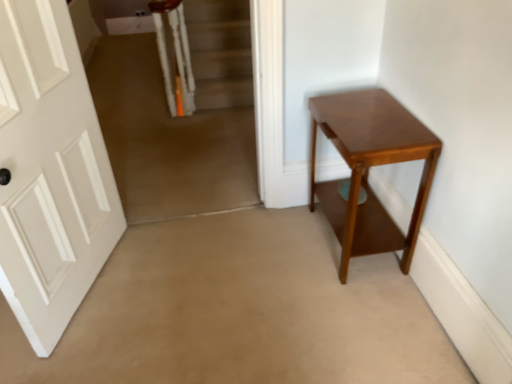
You are a GUI agent. You are given a task and a screenshot of the screen. Output one action in this format:
    pyautogui.click(x=<x>, y=<y>)
    Task: Click on the free space behind carpeted stairs at upper left
    The image size is (512, 384).
    Given the screenshot: What is the action you would take?
    pyautogui.click(x=195, y=169)